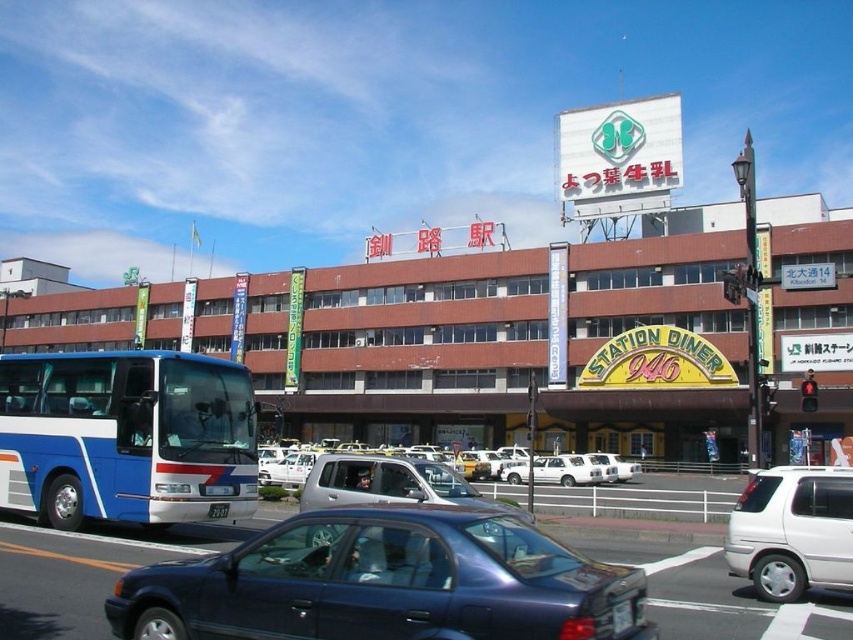
You are a pedestrian standing at the crosswalk in front of the multi story building with a reddish brown facade. You see a white matte van at lower right and a white matte sedan at center. Which vehicle is nearer to you?

The white matte van at lower right is closer to the viewer than the white matte sedan at center, so the van is nearer to you.

You are a delivery person who needs to park your vehicle in a spot that can accommodate your white matte van at lower right. The parking space is designed to fit vehicles up to the length of the white matte sedan at center. Will your van fit?

The white matte van at lower right is shorter than the white matte sedan at center, so it will fit in the parking space designed for the sedan.